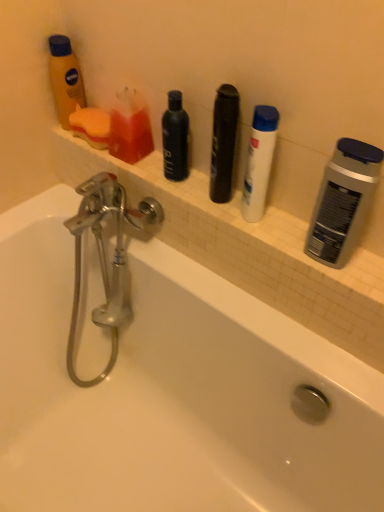
Image resolution: width=384 pixels, height=512 pixels. Identify the location of empty space that is ontop of beige tile ledge at upper center. (197, 186).